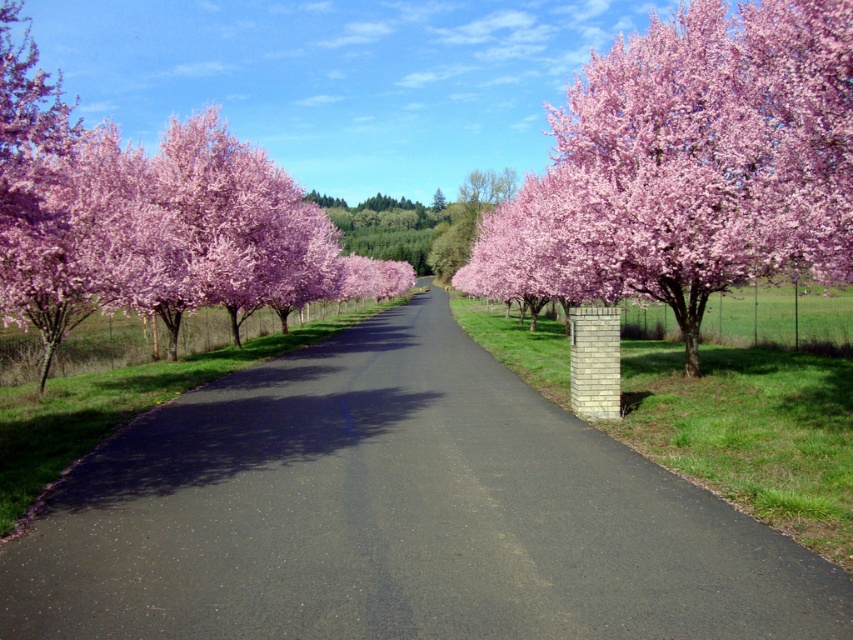
Question: Does black asphalt driveway at center come in front of pink blossoming tree at left?

Choices:
 (A) no
 (B) yes

Answer: (B)

Question: Does pink bloom at center have a smaller size compared to pink blossoming tree at left?

Choices:
 (A) no
 (B) yes

Answer: (B)

Question: Which object is closer to the camera taking this photo?

Choices:
 (A) pink blossoming tree at left
 (B) black asphalt driveway at center
 (C) pink bloom at center

Answer: (B)

Question: Which object is positioned farthest from the pink blossoming tree at left?

Choices:
 (A) pink bloom at center
 (B) black asphalt driveway at center

Answer: (B)

Question: Is pink bloom at center to the right of pink blossoming tree at left from the viewer's perspective?

Choices:
 (A) no
 (B) yes

Answer: (B)

Question: Considering the real-world distances, which object is farthest from the pink bloom at center?

Choices:
 (A) pink blossoming tree at left
 (B) black asphalt driveway at center

Answer: (A)